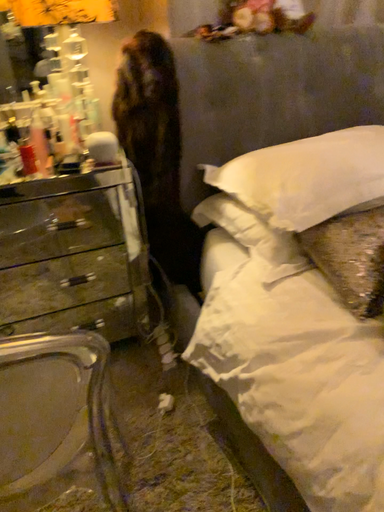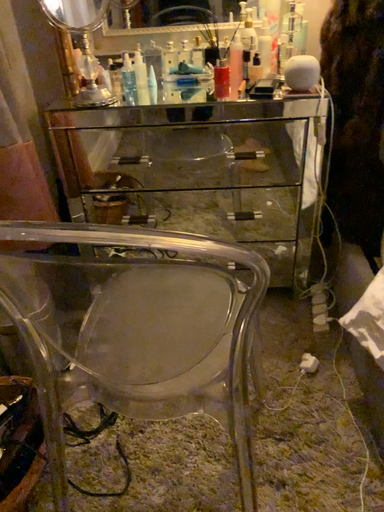
Question: Which way did the camera rotate in the video?

Choices:
 (A) rotated right
 (B) rotated left

Answer: (B)